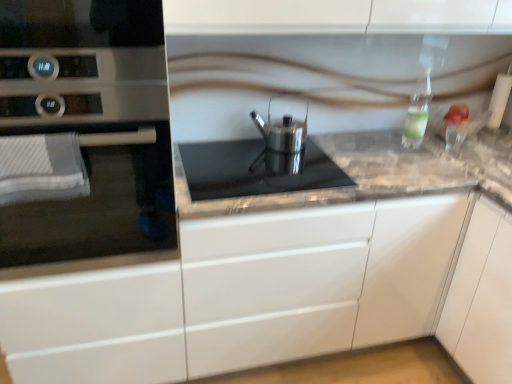
Identify the location of vacant space to the right of clear glass bottle at upper right. This screenshot has width=512, height=384. (445, 153).